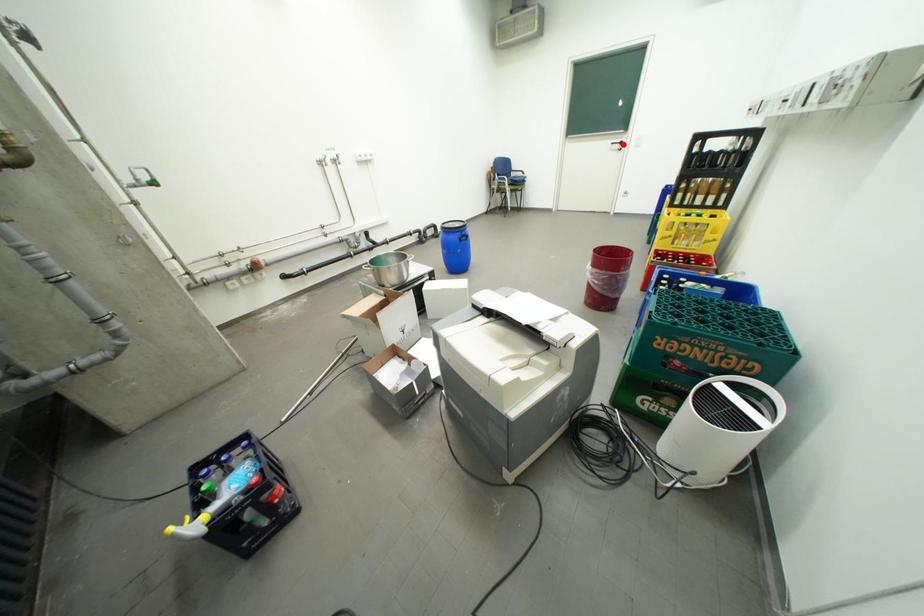
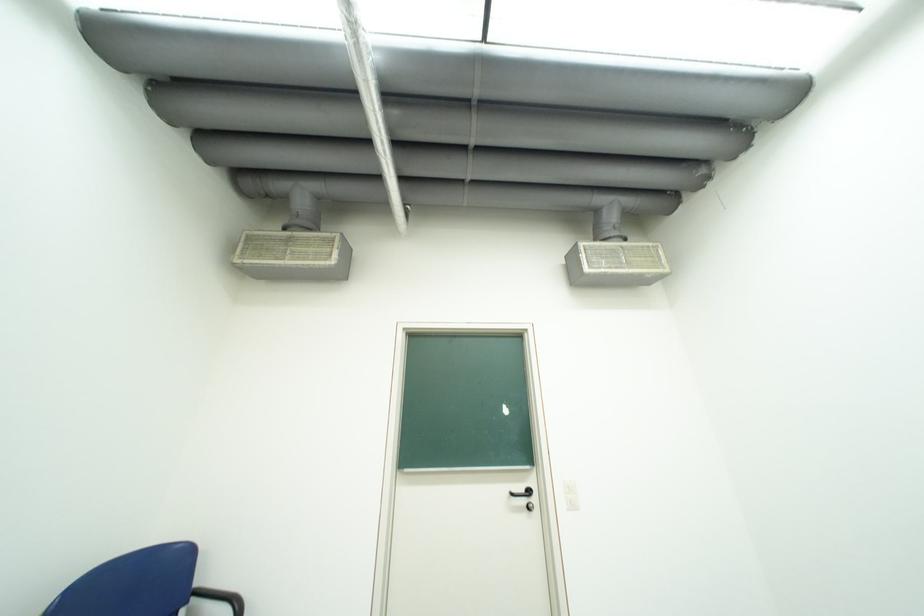
Question: A red point is marked in image1. In image2, is the corresponding 3D point closer to the camera or farther? Reply with the corresponding letter.

Choices:
 (A) The corresponding 3D point is closer.
 (B) The corresponding 3D point is farther.

Answer: (B)